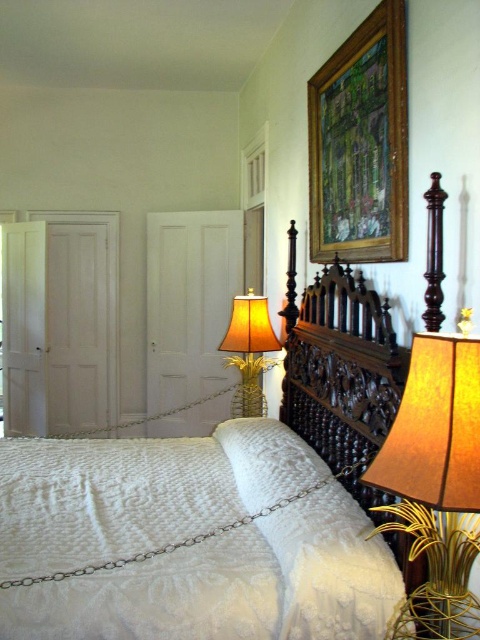
Is the position of white quilted fabric bed at center less distant than that of wooden picture frame at upper center?

Yes, it is.

Between white quilted fabric bed at center and wooden picture frame at upper center, which one has less height?

Standing shorter between the two is white quilted fabric bed at center.

At what (x,y) coordinates should I click in order to perform the action: click on white quilted fabric bed at center. Please return your answer as a coordinate pair (x, y). Looking at the image, I should click on (192, 538).

Can you confirm if wooden picture frame at upper center is thinner than gold metallic pineapple at center?

Yes, wooden picture frame at upper center is thinner than gold metallic pineapple at center.

What do you see at coordinates (360, 145) in the screenshot? The image size is (480, 640). I see `wooden picture frame at upper center` at bounding box center [360, 145].

You are a GUI agent. You are given a task and a screenshot of the screen. Output one action in this format:
    pyautogui.click(x=<x>, y=<y>)
    Task: Click on the wooden picture frame at upper center
    The image size is (480, 640).
    Given the screenshot: What is the action you would take?
    pyautogui.click(x=360, y=145)

At what (x,y) coordinates should I click in order to perform the action: click on wooden picture frame at upper center. Please return your answer as a coordinate pair (x, y). This screenshot has height=640, width=480. Looking at the image, I should click on (360, 145).

Between white quilted fabric bed at center and gold textured lampshade at right, which one has less height?

Standing shorter between the two is gold textured lampshade at right.

Is white quilted fabric bed at center positioned in front of gold textured lampshade at right?

No, it is not.

Does point (373, 541) lie behind point (459, 621)?

Yes, it is behind point (459, 621).

You are a GUI agent. You are given a task and a screenshot of the screen. Output one action in this format:
    pyautogui.click(x=<x>, y=<y>)
    Task: Click on the white quilted fabric bed at center
    
    Given the screenshot: What is the action you would take?
    pyautogui.click(x=192, y=538)